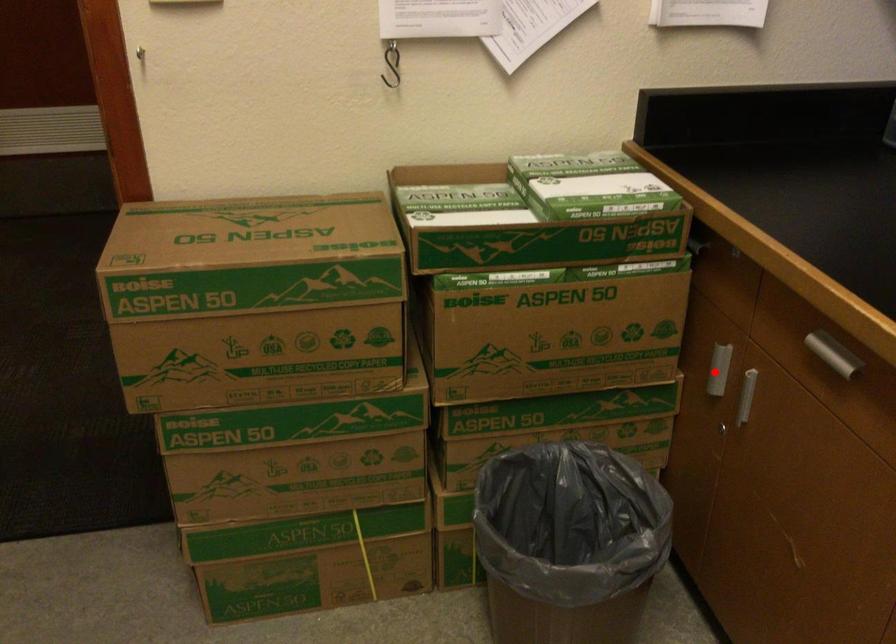
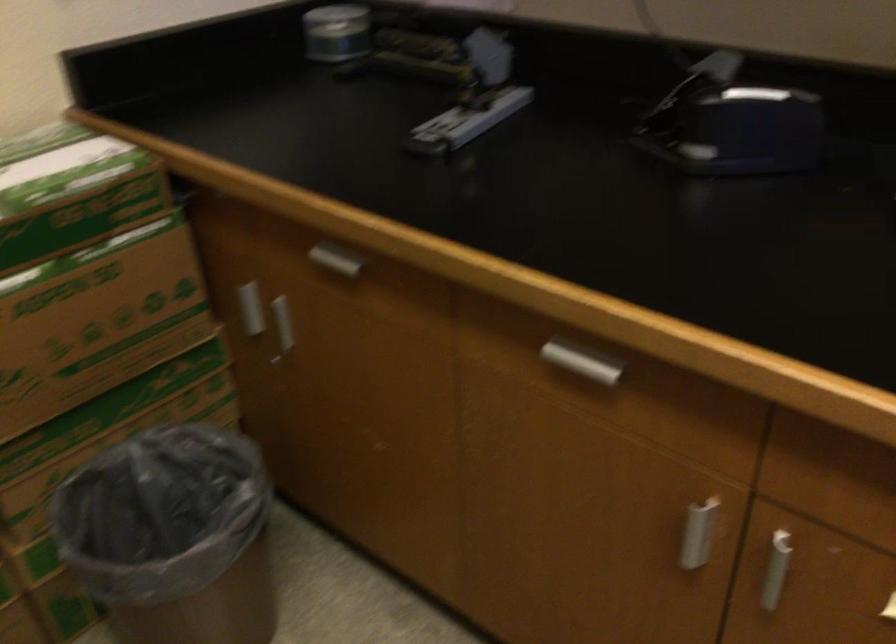
The point at the highlighted location is marked in the first image. Where is the corresponding point in the second image?

(251, 308)